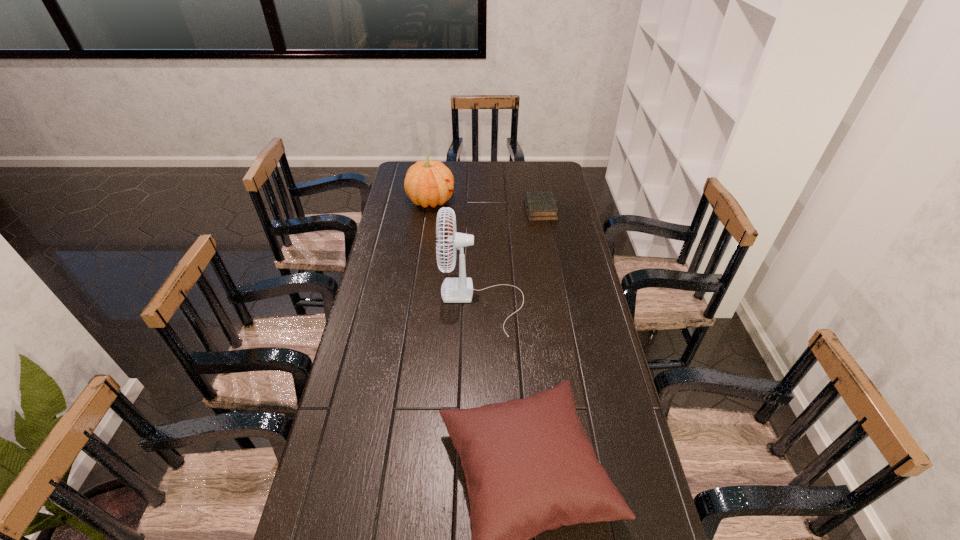
I want to click on vacant area in the image that satisfies the following two spatial constraints: 1. on the carved face of the second tallest object; 2. on the left side of the book, so click(x=429, y=210).

Where is `vacant space that satisfies the following two spatial constraints: 1. on the carved face of the third shortest object; 2. on the right side of the book`? vacant space that satisfies the following two spatial constraints: 1. on the carved face of the third shortest object; 2. on the right side of the book is located at coordinates (429, 210).

I want to click on free spot that satisfies the following two spatial constraints: 1. on the carved face of the shortest object; 2. on the right side of the pumpkin, so click(x=429, y=210).